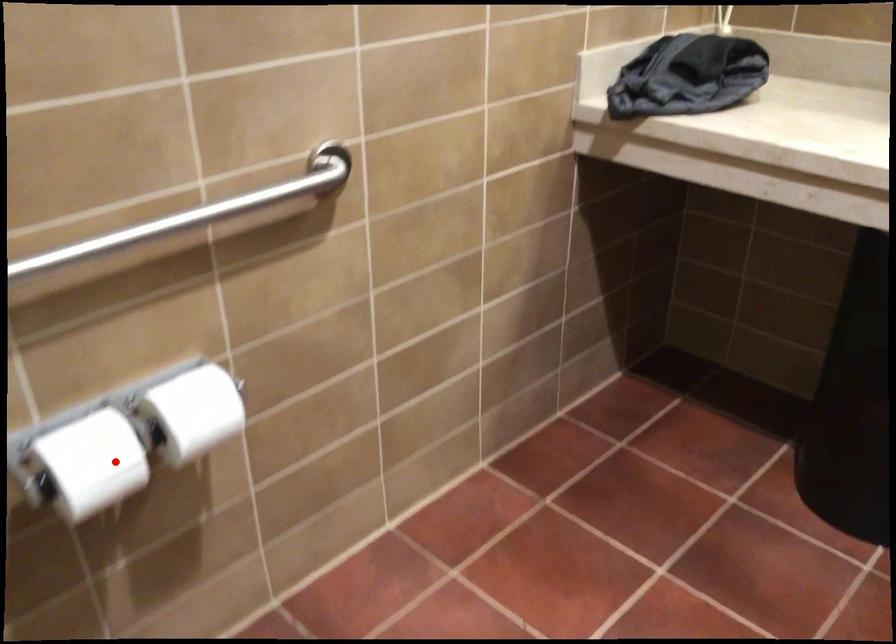
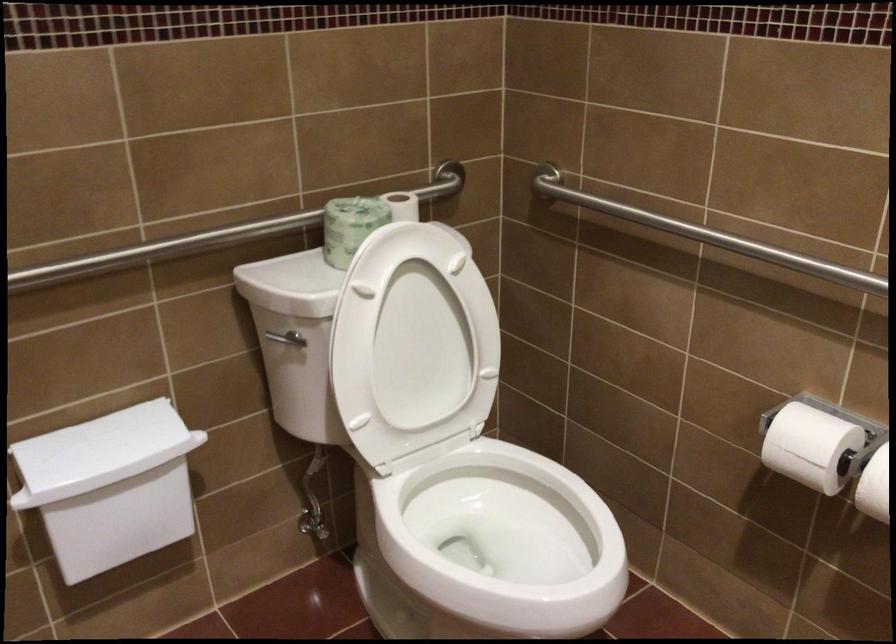
Find the pixel in the second image that matches the highlighted location in the first image.

(810, 446)